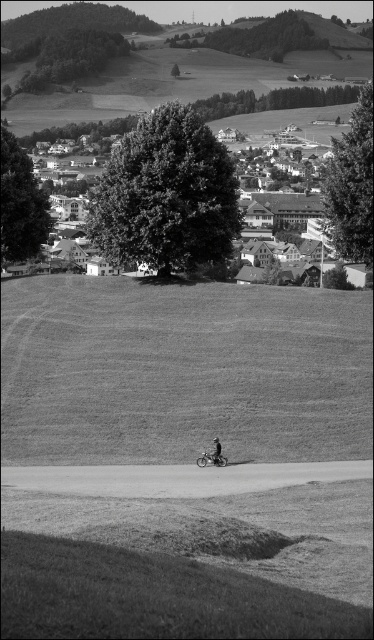
Question: Does grassy field at center have a smaller size compared to black matte bicycle at center?

Choices:
 (A) no
 (B) yes

Answer: (A)

Question: Is grassy field at center above metallic silver motorcycle at center?

Choices:
 (A) yes
 (B) no

Answer: (A)

Question: Estimate the real-world distances between objects in this image. Which object is closer to the dirt/gravel path at center?

Choices:
 (A) grassy field at center
 (B) metallic silver motorcycle at center

Answer: (B)

Question: Can you confirm if dirt/gravel path at center is positioned above metallic silver motorcycle at center?

Choices:
 (A) no
 (B) yes

Answer: (A)

Question: Estimate the real-world distances between objects in this image. Which object is farther from the dirt/gravel path at center?

Choices:
 (A) grassy field at center
 (B) grassy hillside at upper center
 (C) metallic silver motorcycle at center
 (D) black matte bicycle at center

Answer: (B)

Question: Which of the following is the closest to the observer?

Choices:
 (A) grassy hillside at upper center
 (B) dirt/gravel path at center
 (C) metallic silver motorcycle at center
 (D) black matte bicycle at center

Answer: (B)